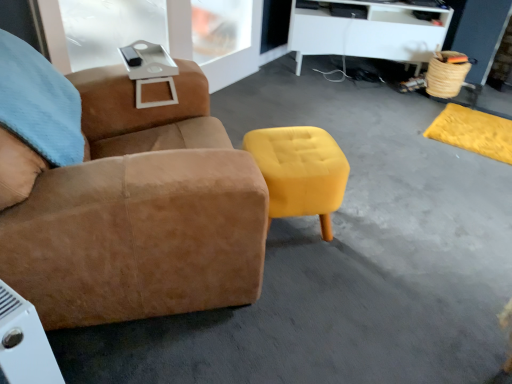
Identify the location of vacant location below yellow suede ottoman at center (from a real-world perspective). (294, 231).